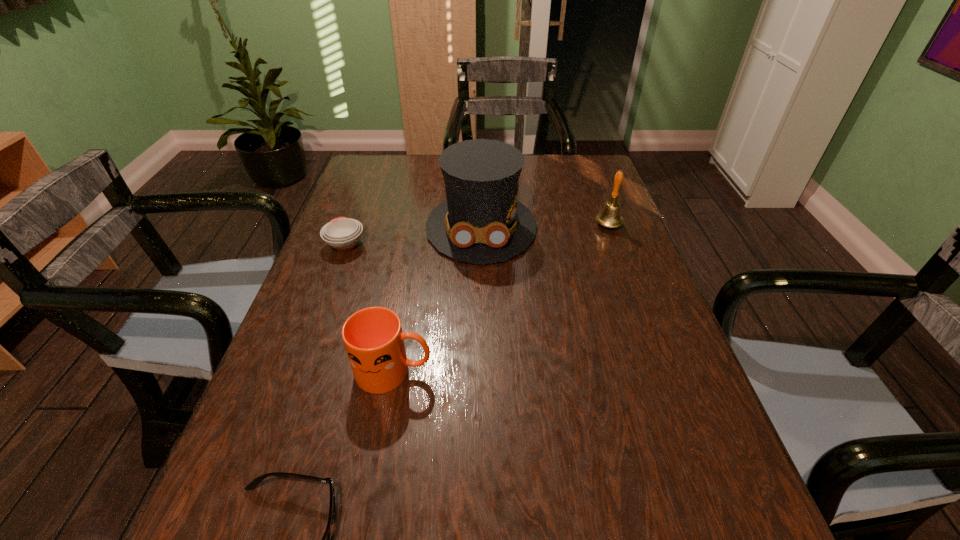
Locate an element on the screen. The width and height of the screenshot is (960, 540). the tallest object is located at coordinates (481, 221).

This screenshot has height=540, width=960. In order to click on the second tallest object in this screenshot , I will do `click(610, 216)`.

I want to click on the rightmost object, so click(610, 216).

I want to click on mug, so click(373, 338).

The width and height of the screenshot is (960, 540). Identify the location of the third tallest object. (373, 338).

Where is `the fourth tallest object`? This screenshot has height=540, width=960. the fourth tallest object is located at coordinates (342, 233).

Locate an element on the screen. vacant area located with goggles on the front of the tallest object is located at coordinates (482, 368).

I want to click on free spot located on the back of the rightmost object, so click(591, 179).

Identify the location of vacant space situated 0.330m on the handle side of the second nearest object. (599, 372).

Locate an element on the screen. The width and height of the screenshot is (960, 540). vacant area located 0.130m on the back of the soup bowl is located at coordinates (360, 205).